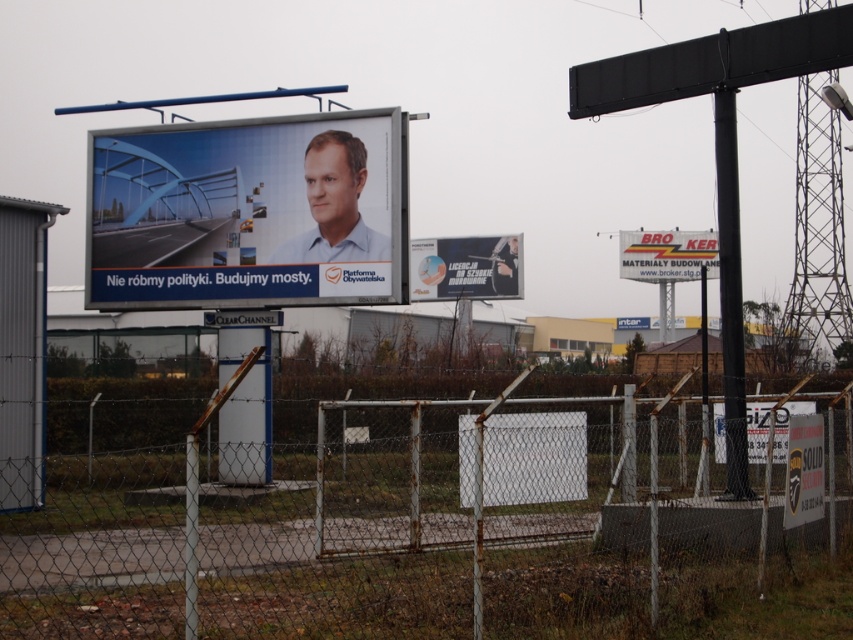
You are standing in front of the billboard on the left side of the image. You notice two points marked on the ground. One is at coordinate point (451, 451) and the other is at point (131, 128). Which point is closer to you?

Point (451, 451) is closer to the viewer than point (131, 128).